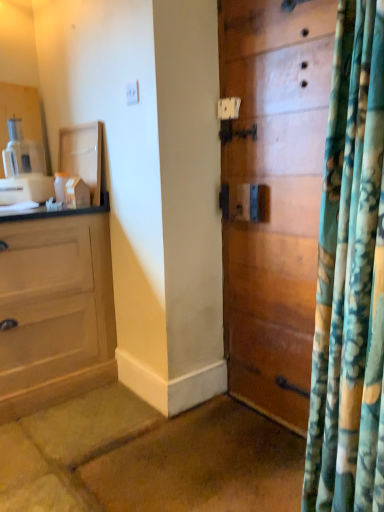
Question: Does white plastic coffee machine at left turn towards wooden door at center?

Choices:
 (A) yes
 (B) no

Answer: (B)

Question: Is white plastic coffee machine at left thinner than wooden door at center?

Choices:
 (A) yes
 (B) no

Answer: (B)

Question: Is white plastic coffee machine at left oriented away from wooden door at center?

Choices:
 (A) no
 (B) yes

Answer: (A)

Question: Does white plastic coffee machine at left have a lesser height compared to wooden door at center?

Choices:
 (A) yes
 (B) no

Answer: (A)

Question: Is white plastic coffee machine at left directly adjacent to wooden door at center?

Choices:
 (A) yes
 (B) no

Answer: (B)

Question: Does white plastic coffee machine at left appear on the right side of wooden door at center?

Choices:
 (A) yes
 (B) no

Answer: (B)

Question: Is wooden door at center facing towards white plastic coffee machine at left?

Choices:
 (A) no
 (B) yes

Answer: (A)

Question: Does wooden door at center have a lesser width compared to white plastic coffee machine at left?

Choices:
 (A) yes
 (B) no

Answer: (A)

Question: From the image's perspective, does wooden door at center appear lower than white plastic coffee machine at left?

Choices:
 (A) no
 (B) yes

Answer: (B)

Question: Considering the relative positions of wooden door at center and white plastic coffee machine at left in the image provided, is wooden door at center to the left of white plastic coffee machine at left from the viewer's perspective?

Choices:
 (A) no
 (B) yes

Answer: (A)

Question: From a real-world perspective, is wooden door at center under white plastic coffee machine at left?

Choices:
 (A) no
 (B) yes

Answer: (B)

Question: Can you confirm if wooden door at center is shorter than white plastic coffee machine at left?

Choices:
 (A) no
 (B) yes

Answer: (A)

Question: Is wooden door at center inside the boundaries of white plastic coffee machine at left, or outside?

Choices:
 (A) inside
 (B) outside

Answer: (B)